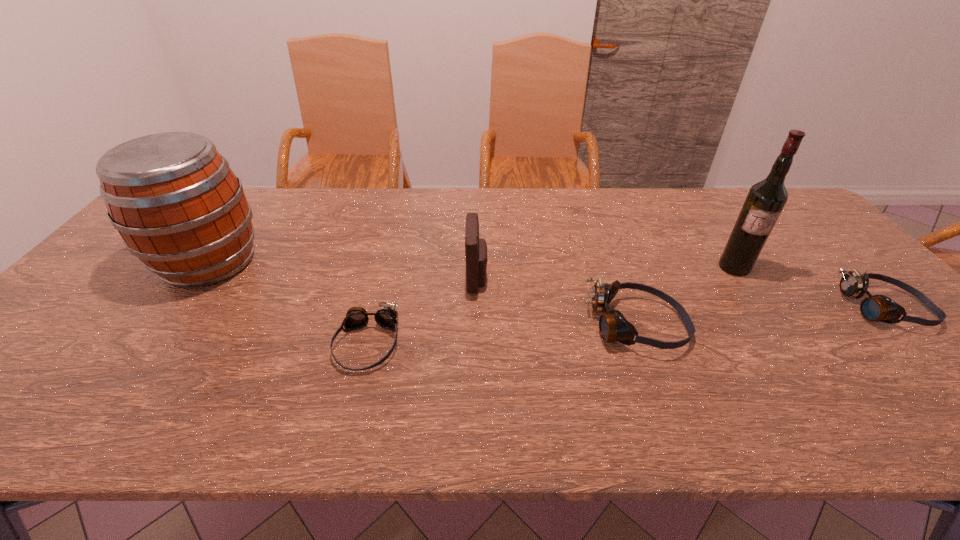
Find the location of `the third closest object to the fourth shortest object`. the third closest object to the fourth shortest object is located at coordinates (178, 206).

Select which goggles is the second closest to the rightmost object. Please provide its 2D coordinates. Your answer should be formatted as a tuple, i.e. [(x, y)], where the tuple contains the x and y coordinates of a point satisfying the conditions above.

[(386, 316)]

Choose which goggles is the nearest neighbor to the shortest object. Please provide its 2D coordinates. Your answer should be formatted as a tuple, i.e. [(x, y)], where the tuple contains the x and y coordinates of a point satisfying the conditions above.

[(613, 327)]

Find the location of a particular element. Image resolution: width=960 pixels, height=540 pixels. free spot that satisfies the following two spatial constraints: 1. with an open flap on the fourth object from right to left; 2. through the lenses of the shortest goggles is located at coordinates (476, 344).

What are the coordinates of `vacant area that satisfies the following two spatial constraints: 1. on the front and back of the second object from right to left; 2. through the lenses of the fourth object from left to right` in the screenshot? It's located at (773, 326).

Where is `blank space that satisfies the following two spatial constraints: 1. with an open flap on the third object from left to right; 2. through the lenses of the shortest object`? The height and width of the screenshot is (540, 960). blank space that satisfies the following two spatial constraints: 1. with an open flap on the third object from left to right; 2. through the lenses of the shortest object is located at coordinates (476, 344).